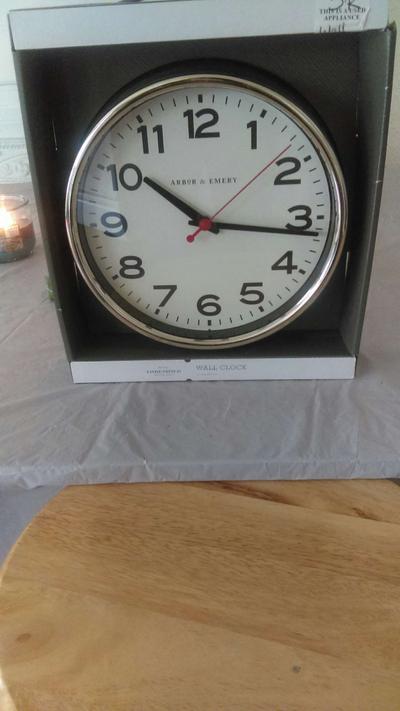
Identify the location of word wall. This screenshot has height=711, width=400. (332, 28), (206, 368).